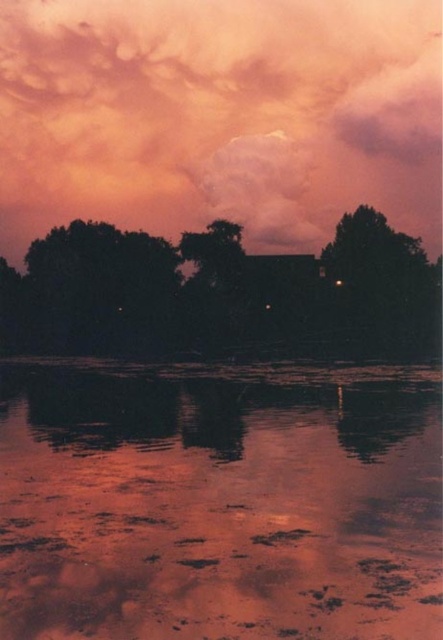
Who is higher up, smooth reflective water at center or silhouette leafy tree at center?

silhouette leafy tree at center is higher up.

Is smooth reflective water at center closer to camera compared to silhouette leafy tree at center?

Yes, smooth reflective water at center is closer to the viewer.

Does point (15, 477) lie behind point (213, 256)?

No.

The image size is (443, 640). In order to click on smooth reflective water at center in this screenshot , I will do `click(220, 500)`.

Can you confirm if smooth reflective water at center is smaller than cloudy sky at upper center?

Yes.

Is smooth reflective water at center further to camera compared to cloudy sky at upper center?

That is False.

The image size is (443, 640). Find the location of `smooth reflective water at center`. smooth reflective water at center is located at coordinates (220, 500).

Consider the image. Is cloudy sky at upper center positioned before silhouette leafy tree at center?

No, cloudy sky at upper center is behind silhouette leafy tree at center.

Is point (55, 22) farther from camera compared to point (120, 349)?

Yes, point (55, 22) is farther from viewer.

Find the location of a particular element. Image resolution: width=443 pixels, height=640 pixels. cloudy sky at upper center is located at coordinates (220, 116).